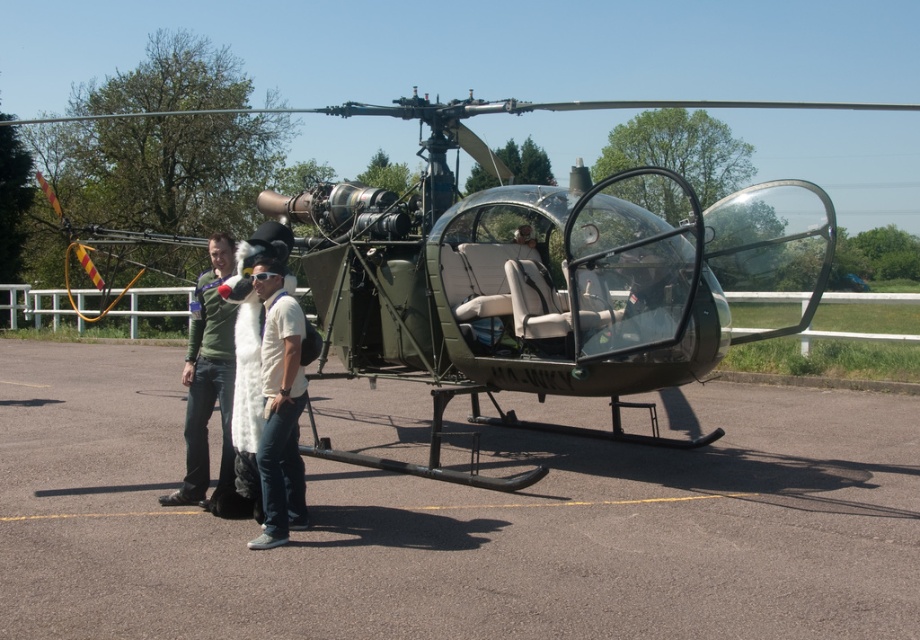
Question: Does gray asphalt tarmac at center appear on the left side of white fabric dress at center?

Choices:
 (A) yes
 (B) no

Answer: (B)

Question: Which point is closer to the camera taking this photo?

Choices:
 (A) (224, 408)
 (B) (651, 221)
 (C) (158, 353)

Answer: (A)

Question: Can you confirm if white fur coat at center is positioned above white fabric dress at center?

Choices:
 (A) no
 (B) yes

Answer: (B)

Question: Which point appears closest to the camera in this image?

Choices:
 (A) (262, 243)
 (B) (208, 314)

Answer: (A)

Question: From the image, what is the correct spatial relationship of gray asphalt tarmac at center in relation to white fabric dress at center?

Choices:
 (A) left
 (B) right

Answer: (B)

Question: Which object is closer to the camera taking this photo?

Choices:
 (A) white fabric dress at center
 (B) green matte helicopter at center

Answer: (B)